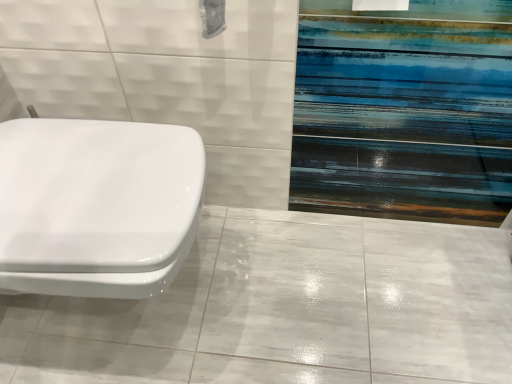
I want to click on empty space that is to the right of white glossy toilet at left, so click(x=294, y=289).